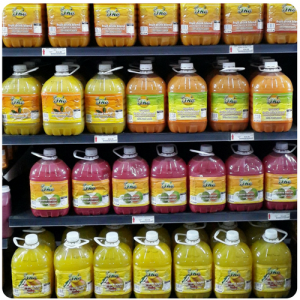
Locate an element on the screen. This screenshot has width=300, height=300. shelf is located at coordinates (183, 216), (181, 136), (180, 48), (180, 247).